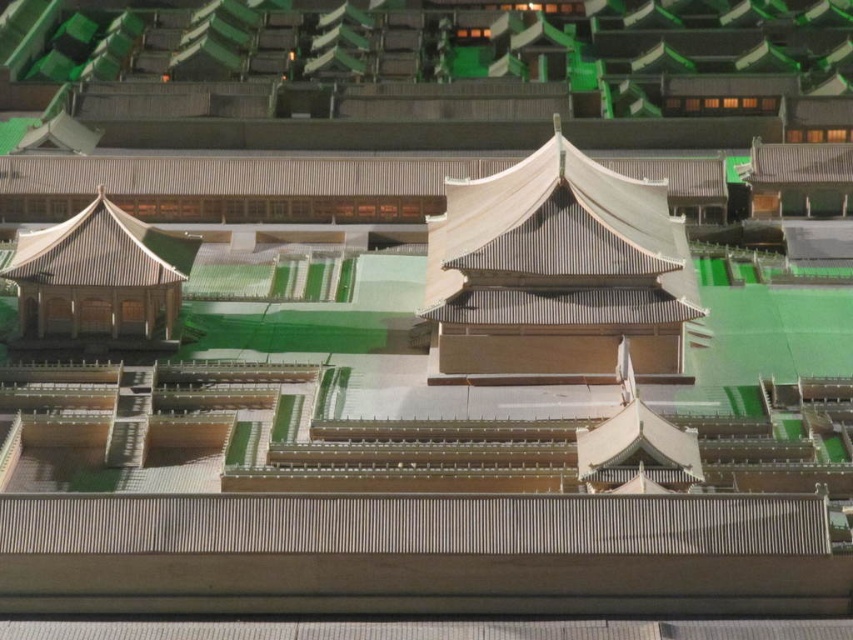
Does matte gray roof at center appear on the right side of matte brown gazebo at left?

Yes, matte gray roof at center is to the right of matte brown gazebo at left.

Does matte gray roof at center lie behind matte brown gazebo at left?

No, matte gray roof at center is closer to the viewer.

This screenshot has height=640, width=853. In order to click on matte gray roof at center in this screenshot , I will do `click(555, 228)`.

The width and height of the screenshot is (853, 640). I want to click on matte gray roof at center, so click(555, 228).